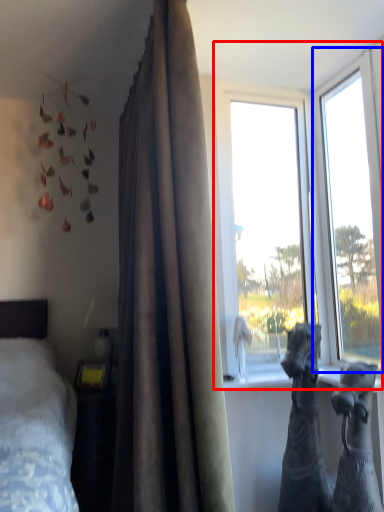
Question: Among these objects, which one is nearest to the camera, window (highlighted by a red box) or window (highlighted by a blue box)?

Choices:
 (A) window
 (B) window

Answer: (B)